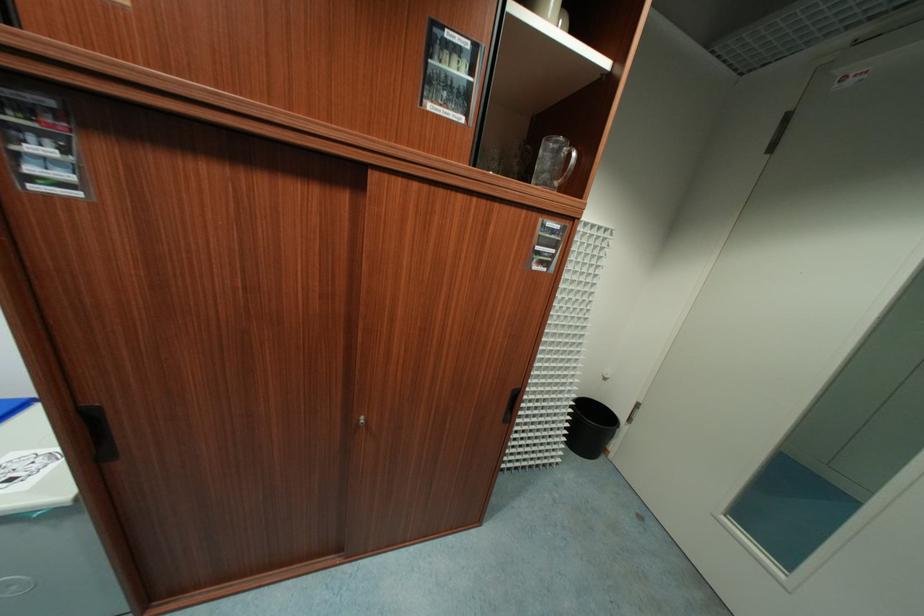
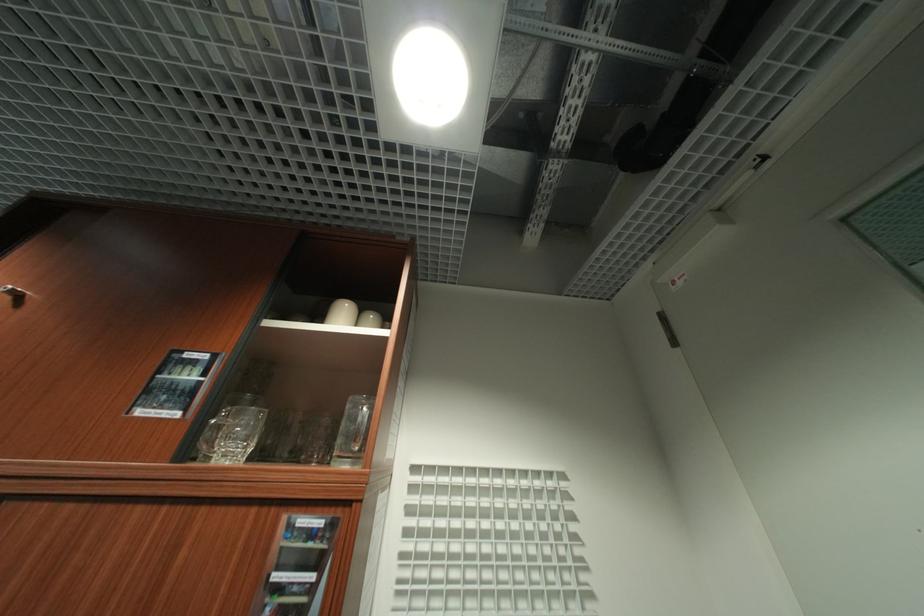
Question: Based on the continuous images, in which direction is the camera rotating? Reply with the corresponding letter.

Choices:
 (A) Left
 (B) Right
 (C) Up
 (D) Down

Answer: (C)